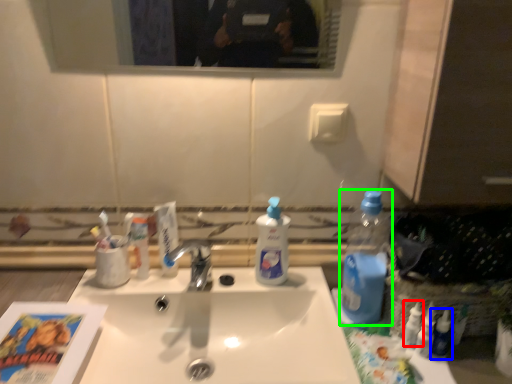
Question: Estimate the real-world distances between objects in this image. Which object is farther from toiletry (highlighted by a red box), toiletry (highlighted by a blue box) or bottle (highlighted by a green box)?

Choices:
 (A) toiletry
 (B) bottle

Answer: (B)